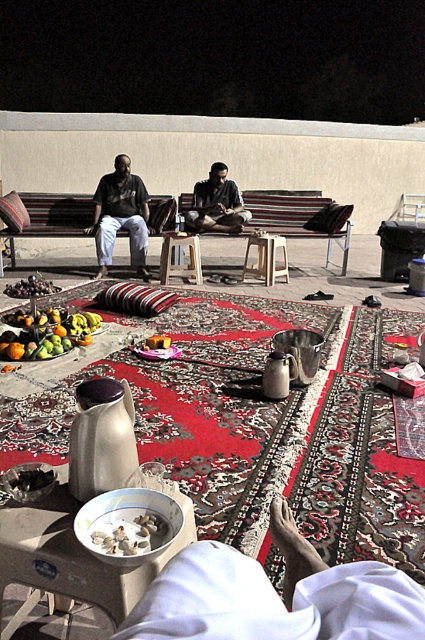
You are a photographer setting up a shot of the scene. You need to ensure that both the matte black shirt at left and the black matte food at lower left are visible in the frame. Given their sizes, which object might you need to adjust your camera angle to better highlight?

The matte black shirt at left is larger in size than the black matte food at lower left, so you might need to adjust the camera angle to ensure the smaller black matte food at lower left is adequately captured in the frame.

You are standing at the origin point in the image. Where is the matte black shirt at center located in terms of coordinates?

The matte black shirt at center is located at coordinates point (217, 204).

You are standing at the edge of the red patterned carpet and want to place a new decorative item exactly where the shiny metallic bowl at center is currently located. What are the coordinates where you should place it?

The coordinates for the shiny metallic bowl at center are at point (48, 333), so you should place the new decorative item there.